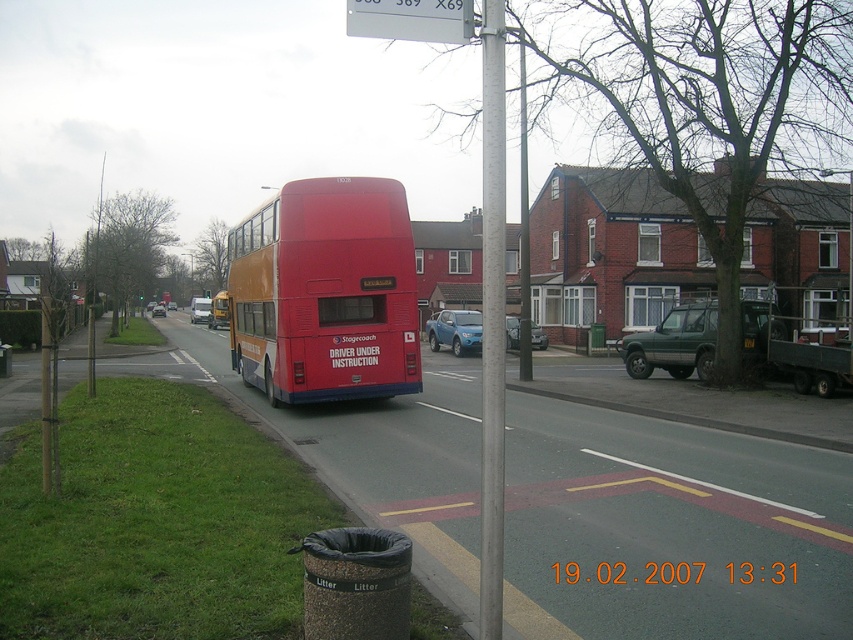
Question: Which of these objects is positioned closest to the metallic pole at center?

Choices:
 (A) red matte bus at center
 (B) white plastic sign at upper center
 (C) matte red bus at center

Answer: (B)

Question: Among these objects, which one is nearest to the camera?

Choices:
 (A) red matte bus at center
 (B) metallic pole at center

Answer: (B)

Question: Is matte red bus at center below metallic pole at center?

Choices:
 (A) no
 (B) yes

Answer: (B)

Question: Is metallic pole at center below white plastic sign at upper center?

Choices:
 (A) no
 (B) yes

Answer: (B)

Question: Does matte red bus at center have a lesser width compared to red matte bus at center?

Choices:
 (A) no
 (B) yes

Answer: (B)

Question: Among these points, which one is nearest to the camera?

Choices:
 (A) (224, 316)
 (B) (495, 182)
 (C) (387, 33)
 (D) (384, 180)

Answer: (C)